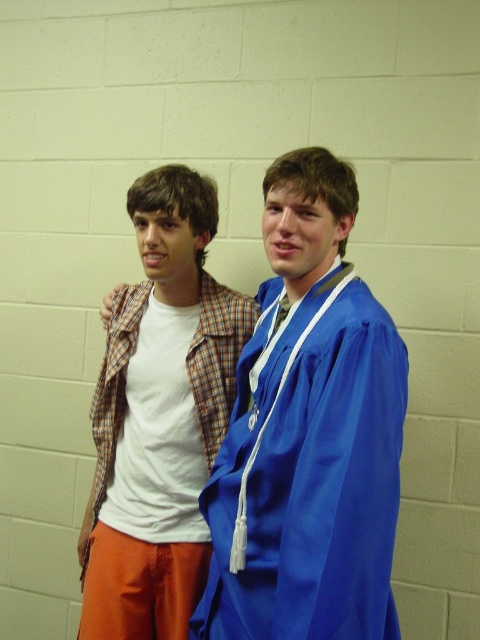
Does point (286, 522) come closer to viewer compared to point (141, 314)?

Yes, point (286, 522) is in front of point (141, 314).

Does satin blue graduation gown at center appear on the right side of white cotton shirt at left?

Yes, satin blue graduation gown at center is to the right of white cotton shirt at left.

Image resolution: width=480 pixels, height=640 pixels. Describe the element at coordinates (309, 474) in the screenshot. I see `satin blue graduation gown at center` at that location.

You are a GUI agent. You are given a task and a screenshot of the screen. Output one action in this format:
    pyautogui.click(x=<x>, y=<y>)
    Task: Click on the satin blue graduation gown at center
    
    Given the screenshot: What is the action you would take?
    (x=309, y=474)